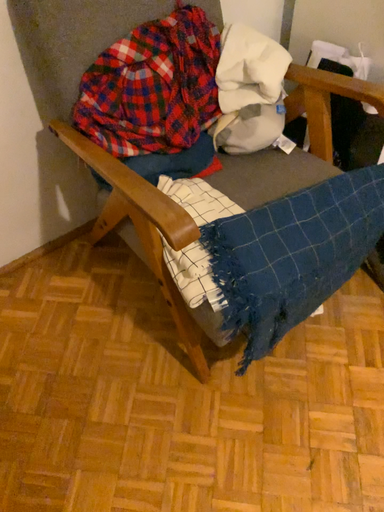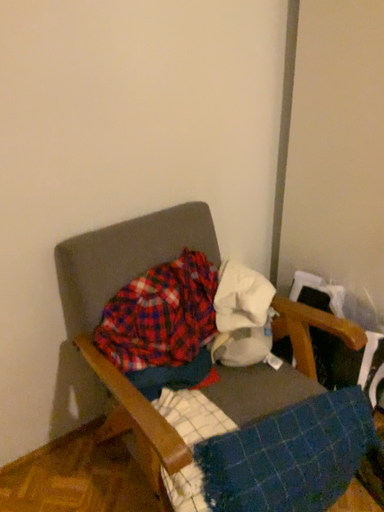
Question: How did the camera likely rotate when shooting the video?

Choices:
 (A) rotated downward
 (B) rotated upward

Answer: (B)